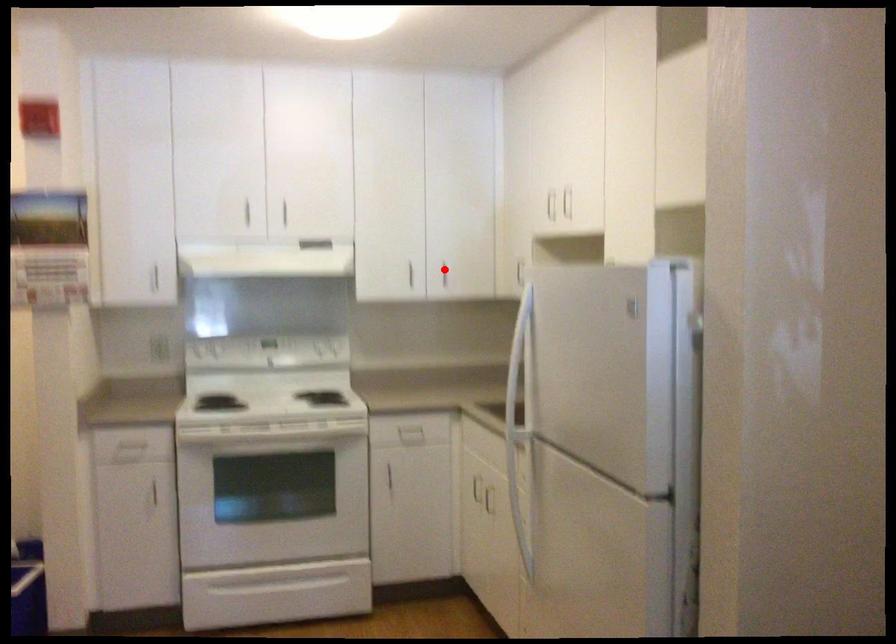
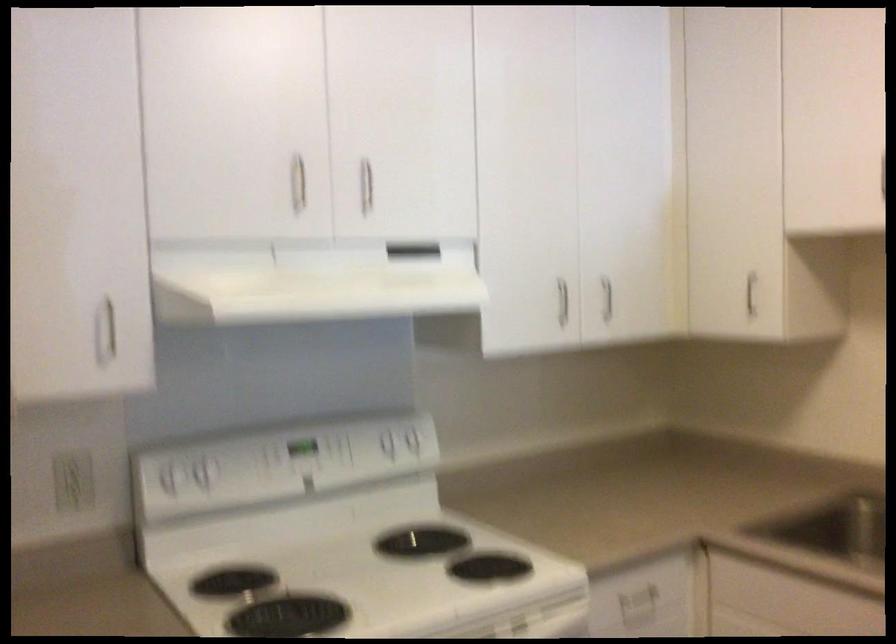
Question: A red point is marked in image1. In image2, is the corresponding 3D point closer to the camera or farther? Reply with the corresponding letter.

Choices:
 (A) The corresponding 3D point is closer.
 (B) The corresponding 3D point is farther.

Answer: (A)